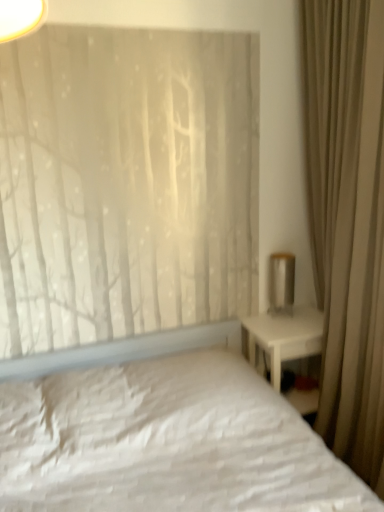
In order to face beige fabric curtain at right, should I rotate leftwards or rightwards?

Turn right by 20.865 degrees to look at beige fabric curtain at right.

Image resolution: width=384 pixels, height=512 pixels. What do you see at coordinates (348, 220) in the screenshot?
I see `beige fabric curtain at right` at bounding box center [348, 220].

At what (x,y) coordinates should I click in order to perform the action: click on beige fabric curtain at right. Please return your answer as a coordinate pair (x, y). Looking at the image, I should click on (348, 220).

Looking at this image, measure the distance between point (273, 277) and camera.

Point (273, 277) and camera are 2.27 meters apart.

Identify the location of matte white rectangular at upper right. (282, 283).

Describe the element at coordinates (282, 283) in the screenshot. I see `matte white rectangular at upper right` at that location.

Identify the location of beige fabric curtain at right. This screenshot has width=384, height=512. (348, 220).

Visually, is matte white rectangular at upper right positioned to the left or to the right of beige fabric curtain at right?

matte white rectangular at upper right is positioned on beige fabric curtain at right's left side.

Is matte white rectangular at upper right in front of or behind beige fabric curtain at right in the image?

matte white rectangular at upper right is positioned farther from the viewer than beige fabric curtain at right.

Is point (275, 292) positioned after point (381, 275)?

Yes, point (275, 292) is farther from viewer.

From the image's perspective, is matte white rectangular at upper right on beige fabric curtain at right?

Incorrect, from the image's perspective, matte white rectangular at upper right is lower than beige fabric curtain at right.

From a real-world perspective, between matte white rectangular at upper right and beige fabric curtain at right, who is vertically lower?

matte white rectangular at upper right.

Considering the relative sizes of matte white rectangular at upper right and beige fabric curtain at right in the image provided, is matte white rectangular at upper right wider than beige fabric curtain at right?

Incorrect, the width of matte white rectangular at upper right does not surpass that of beige fabric curtain at right.

Considering the sizes of objects matte white rectangular at upper right and beige fabric curtain at right in the image provided, who is shorter, matte white rectangular at upper right or beige fabric curtain at right?

Standing shorter between the two is matte white rectangular at upper right.

Considering the relative sizes of matte white rectangular at upper right and beige fabric curtain at right in the image provided, is matte white rectangular at upper right smaller than beige fabric curtain at right?

Yes.

In the scene shown: Is matte white rectangular at upper right inside or outside of beige fabric curtain at right?

matte white rectangular at upper right is enclosed within beige fabric curtain at right.

Are matte white rectangular at upper right and beige fabric curtain at right far apart?

Actually, matte white rectangular at upper right and beige fabric curtain at right are a little close together.

Does matte white rectangular at upper right turn towards beige fabric curtain at right?

Yes, matte white rectangular at upper right is facing beige fabric curtain at right.

Identify the location of curtain in front of the matte white rectangular at upper right. (348, 220).

Can you confirm if beige fabric curtain at right is positioned to the left of matte white rectangular at upper right?

Incorrect, beige fabric curtain at right is not on the left side of matte white rectangular at upper right.

Looking at this image, relative to matte white rectangular at upper right, is beige fabric curtain at right in front or behind?

Clearly, beige fabric curtain at right is in front of matte white rectangular at upper right.

Does point (364, 400) come farther from viewer compared to point (286, 295)?

That is False.

From the image's perspective, does beige fabric curtain at right appear higher than matte white rectangular at upper right?

Yes, from the image's perspective, beige fabric curtain at right is above matte white rectangular at upper right.

From a real-world perspective, is beige fabric curtain at right positioned over matte white rectangular at upper right based on gravity?

Indeed, from a real-world perspective, beige fabric curtain at right stands above matte white rectangular at upper right.

Does beige fabric curtain at right have a lesser width compared to matte white rectangular at upper right?

No.

Can you confirm if beige fabric curtain at right is taller than matte white rectangular at upper right?

Correct, beige fabric curtain at right is much taller as matte white rectangular at upper right.

Is beige fabric curtain at right smaller than matte white rectangular at upper right?

No, beige fabric curtain at right is not smaller than matte white rectangular at upper right.

Is matte white rectangular at upper right a part of beige fabric curtain at right?

Yes, beige fabric curtain at right contains matte white rectangular at upper right.

Is beige fabric curtain at right placed right next to matte white rectangular at upper right?

beige fabric curtain at right and matte white rectangular at upper right are clearly separated.

Could you tell me if beige fabric curtain at right is turned towards matte white rectangular at upper right?

Yes, beige fabric curtain at right is turned towards matte white rectangular at upper right.

In order to click on curtain lying above the matte white rectangular at upper right (from the image's perspective) in this screenshot , I will do `click(348, 220)`.

This screenshot has height=512, width=384. Identify the location of table lamp below the beige fabric curtain at right (from the image's perspective). (282, 283).

Where is `curtain located on the right of matte white rectangular at upper right`? This screenshot has width=384, height=512. curtain located on the right of matte white rectangular at upper right is located at coordinates (348, 220).